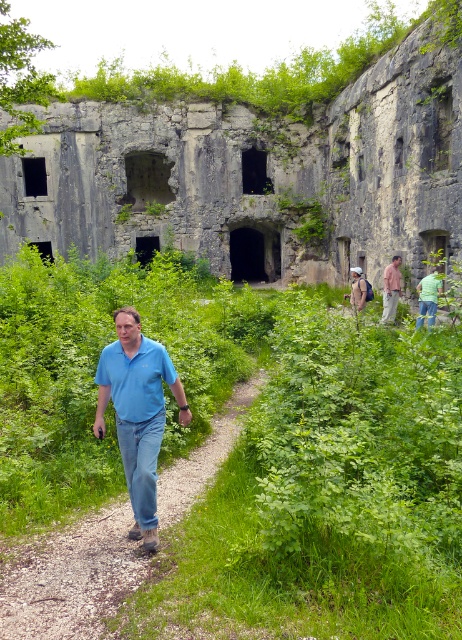
You are a traveler passing through the abandoned fortification and notice a blue denim jeans at center and a pink fabric shirt at center. Which clothing item is wider?

The blue denim jeans at center is wider than the pink fabric shirt at center.

You are standing at the entrance of the historical fortification and see a man wearing blue denim jeans at center and a pink fabric shirt at center. If you want to approach the man, which direction should you walk to get closer to him?

The blue denim jeans at center and pink fabric shirt at center are part of the same person, so approaching either will lead you to the man.